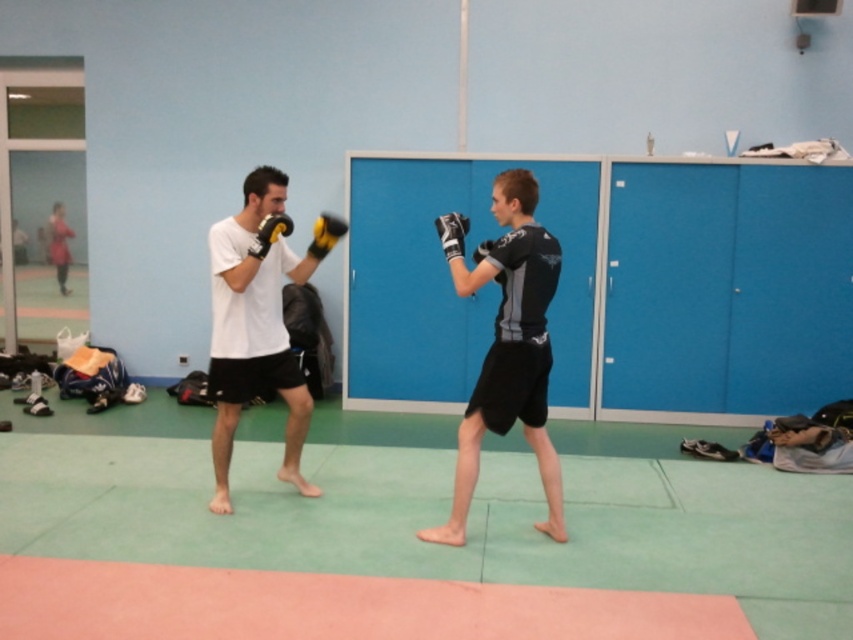
You are a coach observing the sparring session. You want to place a target dummy exactly at the same 2D location as the matte black boxing glove at center. What coordinates should you set for the dummy?

The coordinates for the matte black boxing glove at center are at point (451, 234). Therefore, the target dummy should be placed at coordinates (451, 234).

You are a martial arts instructor standing 4 meters away from the two sparring individuals. You want to ensure safety by placing a protective mat at point [505,381]. Is the distance from your current position to the point sufficient for placing the mat without needing to move closer?

The distance of point [505,381] from the viewer is 3.67 meters. Since you are currently 4 meters away, you can reach the point by moving 0.33 meters closer, so you need to move slightly closer to place the mat.

You are a referee observing a boxing match between two fighters. You notice the matte black boxing glove at center and the yellow matte boxing glove at upper center. Which glove is covering the other?

The matte black boxing glove at center is positioned over the yellow matte glove at upper center, so it is covering the yellow one.